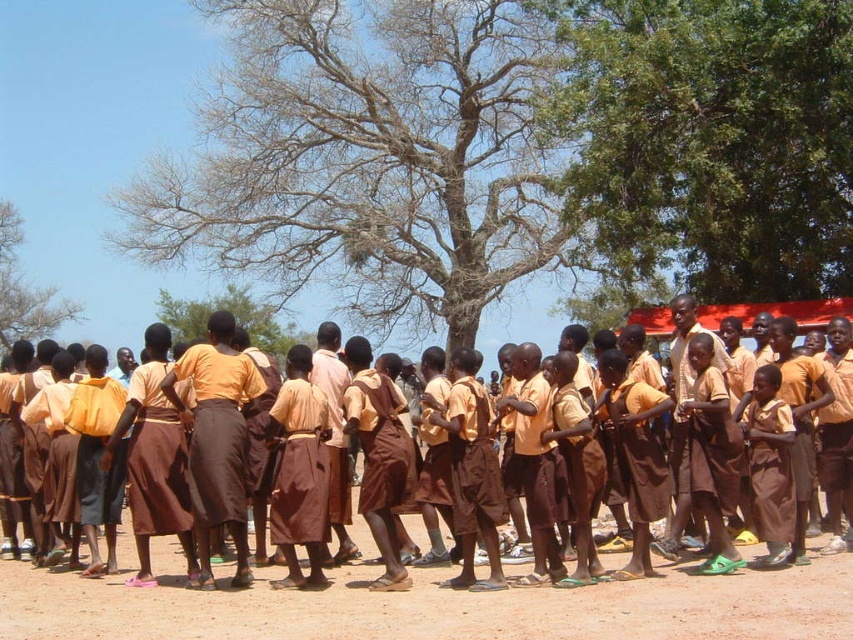
From the picture: You are a photographer trying to capture a photo of the children. The camera you are using has a height adjustment feature. If you want to ensure both the brown dirt field at lower center and the bare branches at upper left are visible in the frame, which object should you position your camera closer to?

You should position your camera closer to the brown dirt field at lower center because it is shorter than the bare branches at upper left, allowing both to be in the frame when adjusting the camera height.

In the scene shown: You are a photographer trying to capture a photo of the children. You notice the brown dirt field at lower center and the brown fabric skirt at center. Which object is positioned closer to you, the photographer?

The brown dirt field at lower center is closer to the viewer than the brown fabric skirt at center, so the brown dirt field at lower center is positioned closer to you, the photographer.

You are a photographer trying to capture a photo of the green leafy tree at center and the brown fabric skirt at center. Based on their sizes, which object would appear bigger in the photo?

The green leafy tree at center would appear bigger in the photo since it has a larger size compared to the brown fabric skirt at center.